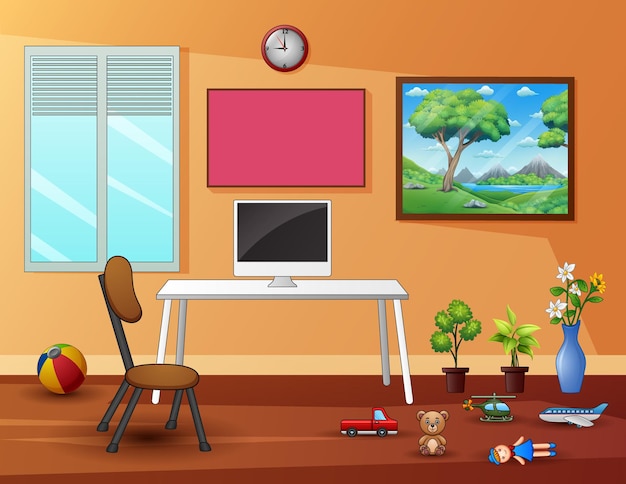
Locate an element on the screen. The height and width of the screenshot is (484, 626). monitor is located at coordinates (282, 250).